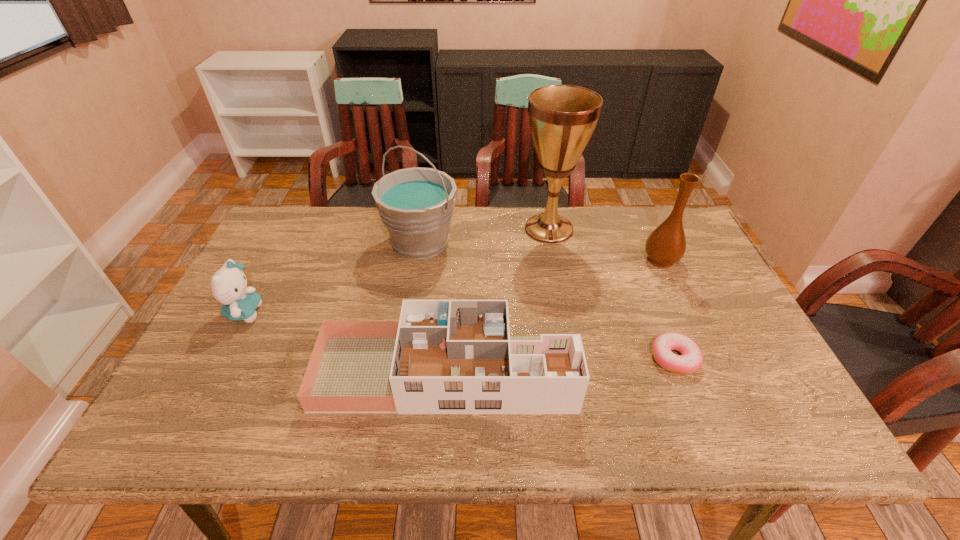
The height and width of the screenshot is (540, 960). Find the location of `object at the far right corner`. object at the far right corner is located at coordinates (666, 245).

The image size is (960, 540). I want to click on free space at the far edge, so click(485, 249).

Image resolution: width=960 pixels, height=540 pixels. In the image, there is a desktop. Find the location of `vacant space at the left edge`. vacant space at the left edge is located at coordinates (212, 385).

Find the location of a particular element. The image size is (960, 540). free space at the right edge of the desktop is located at coordinates (722, 323).

Identify the location of free space at the far left corner. The height and width of the screenshot is (540, 960). (284, 240).

Image resolution: width=960 pixels, height=540 pixels. In the image, there is a desktop. What are the coordinates of `vacant space at the far right corner` in the screenshot? It's located at (657, 207).

This screenshot has height=540, width=960. In order to click on vacant region at the near right corner in this screenshot , I will do `click(783, 425)`.

At what (x,y) coordinates should I click in order to perform the action: click on empty space between the trophy cup and the vase. Please return your answer as a coordinate pair (x, y). Image resolution: width=960 pixels, height=540 pixels. Looking at the image, I should click on (605, 245).

Image resolution: width=960 pixels, height=540 pixels. I want to click on free spot between the bucket and the kitten, so click(333, 278).

You are a GUI agent. You are given a task and a screenshot of the screen. Output one action in this format:
    pyautogui.click(x=<x>, y=<y>)
    Task: Click on the free space between the bucket and the doughnut
    The width and height of the screenshot is (960, 540).
    Given the screenshot: What is the action you would take?
    pyautogui.click(x=547, y=300)